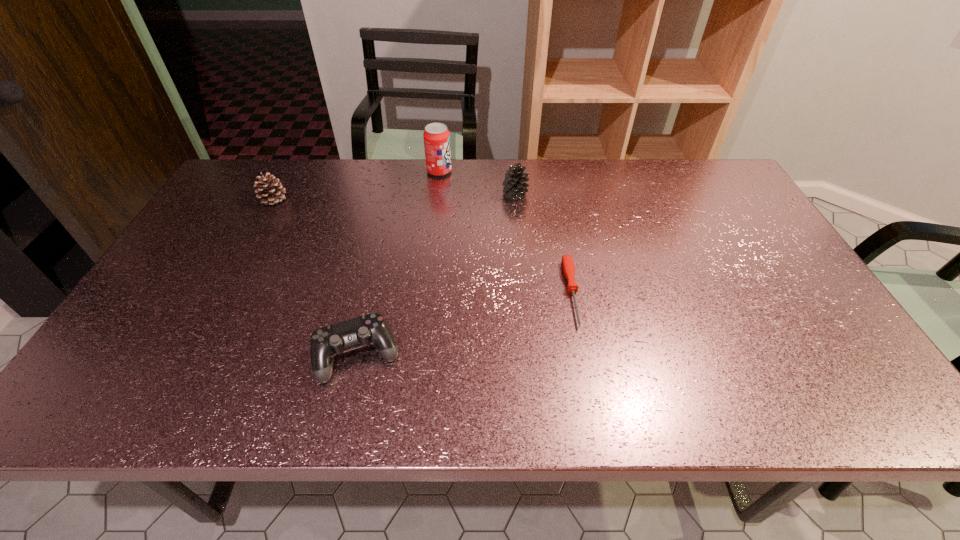
You are a GUI agent. You are given a task and a screenshot of the screen. Output one action in this format:
    pyautogui.click(x=<x>, y=<y>)
    Task: Click on the farthest object
    
    Given the screenshot: What is the action you would take?
    [436, 136]

Locate an element on the screen. the tallest object is located at coordinates pos(436,136).

Identify the location of the taller pinecone. (514, 184).

Image resolution: width=960 pixels, height=540 pixels. What are the coordinates of `the second tallest object` in the screenshot? It's located at (514, 184).

Find the location of a particular element. The width and height of the screenshot is (960, 540). the shorter pinecone is located at coordinates (272, 191).

Image resolution: width=960 pixels, height=540 pixels. I want to click on the left pinecone, so click(x=272, y=191).

Identify the location of control. This screenshot has width=960, height=540. (325, 342).

The width and height of the screenshot is (960, 540). In order to click on the shortest object in this screenshot , I will do `click(567, 262)`.

You are a GUI agent. You are given a task and a screenshot of the screen. Output one action in this format:
    pyautogui.click(x=<x>, y=<y>)
    Task: Click on the screwdriver
    
    Given the screenshot: What is the action you would take?
    pyautogui.click(x=567, y=262)

The image size is (960, 540). Identify the location of vacant area situated on the surface of the soda can. (506, 171).